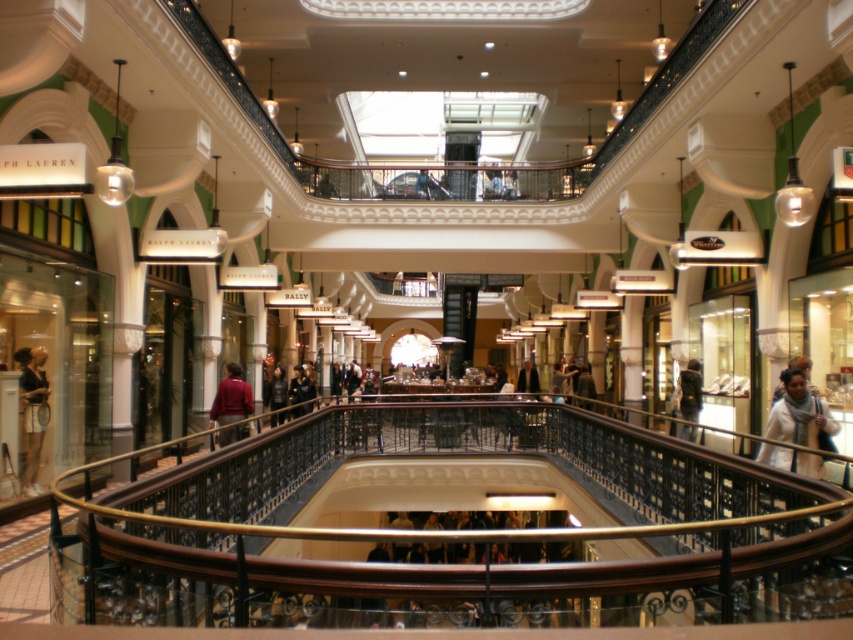
Can you confirm if wooden at center is taller than matte black dress at lower left?

Correct, wooden at center is much taller as matte black dress at lower left.

Is point (753, 577) farther from camera compared to point (39, 417)?

No, it is in front of (39, 417).

Image resolution: width=853 pixels, height=640 pixels. Identify the location of wooden at center. (459, 532).

Measure the distance between matte black dress at lower left and camera.

matte black dress at lower left and camera are 72.26 feet apart.

Who is shorter, matte black dress at lower left or maroon fabric jacket at center?

Standing shorter between the two is maroon fabric jacket at center.

Who is more distant from viewer, (22, 397) or (234, 428)?

Point (234, 428)

The height and width of the screenshot is (640, 853). Identify the location of matte black dress at lower left. (32, 412).

Is white fabric bag at lower right thinner than dark brown leather jacket at center?

Correct, white fabric bag at lower right's width is less than dark brown leather jacket at center's.

Which is below, white fabric bag at lower right or dark brown leather jacket at center?

dark brown leather jacket at center

Between point (792, 426) and point (271, 404), which one is positioned behind?

Positioned behind is point (271, 404).

Find the location of a particular element. white fabric bag at lower right is located at coordinates (798, 413).